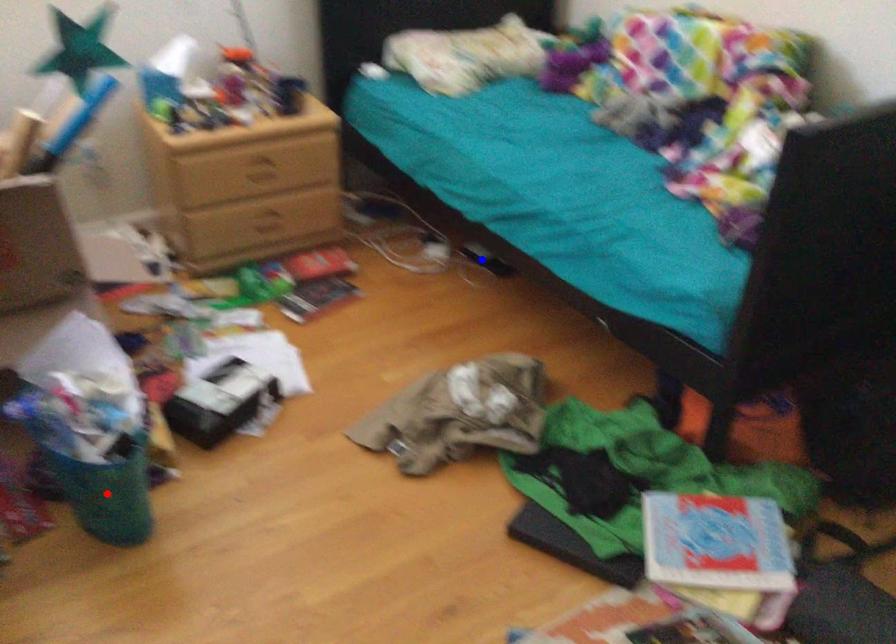
Question: Two points are marked on the image. Which point is closer to the camera?

Choices:
 (A) Blue point is closer.
 (B) Red point is closer.

Answer: (B)